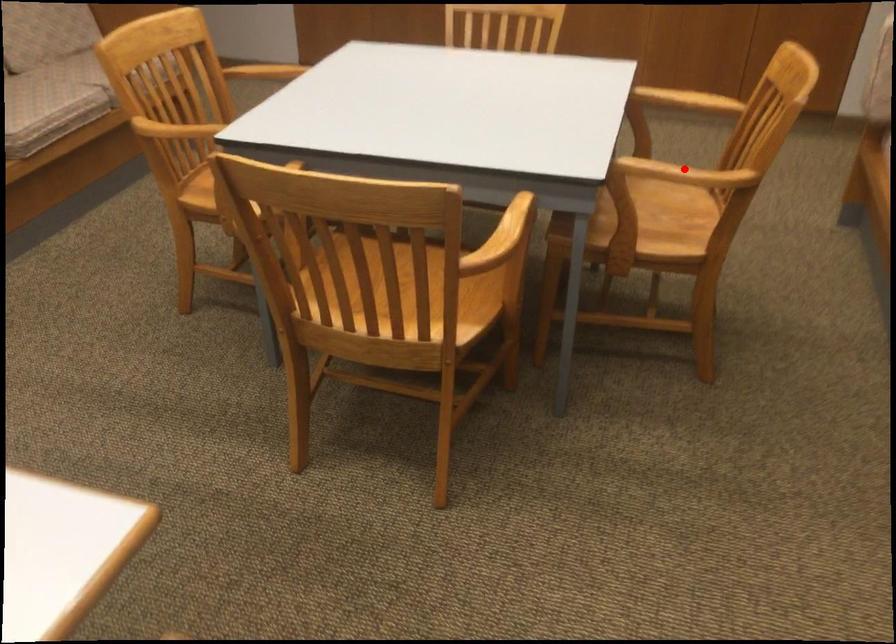
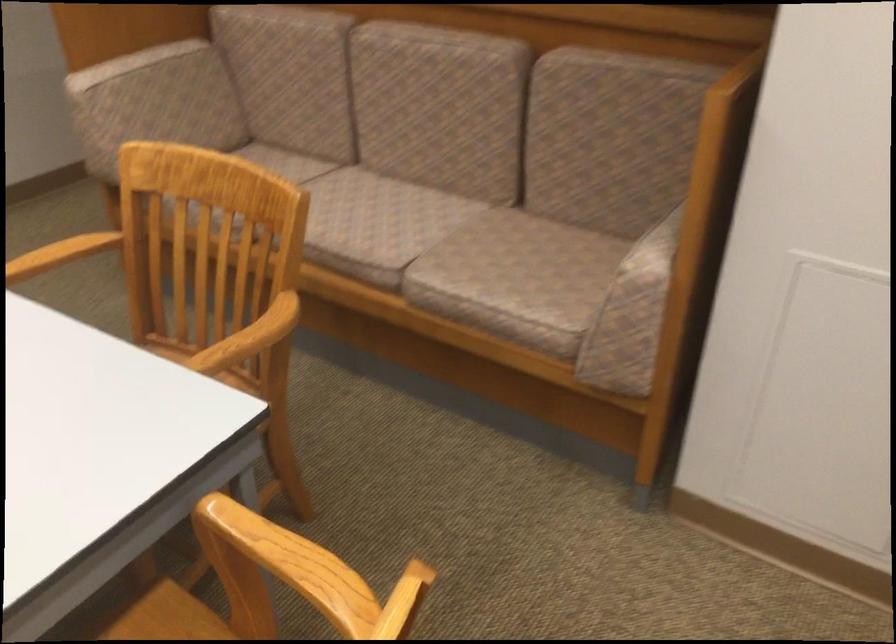
Question: I am providing you with two images of the same scene from different viewpoints. Given a red point in image1, look at the same physical point in image2. Is it:

Choices:
 (A) Closer to the viewpoint
 (B) Farther from the viewpoint

Answer: (A)